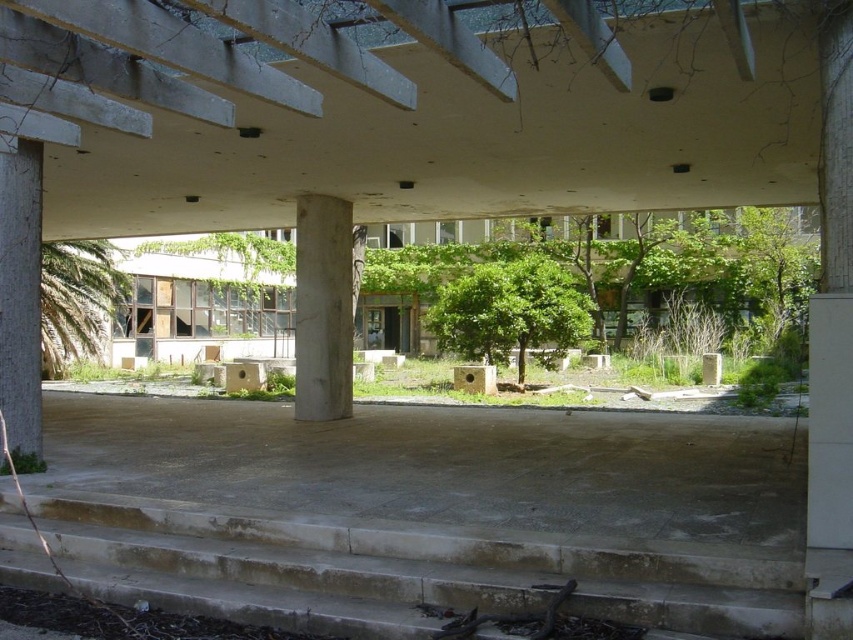
Consider the image. Between concrete stairs at lower left and green leafy tree at left, which one appears on the right side from the viewer's perspective?

concrete stairs at lower left is more to the right.

Is concrete stairs at lower left wider than green leafy tree at left?

In fact, concrete stairs at lower left might be narrower than green leafy tree at left.

Locate an element on the screen. concrete stairs at lower left is located at coordinates (399, 573).

From the picture: Who is taller, green leafy tree at center or green leafy tree at left?

With more height is green leafy tree at center.

Who is higher up, green leafy tree at center or green leafy tree at left?

green leafy tree at center

Which is behind, point (505, 308) or point (73, 358)?

Point (73, 358)

The height and width of the screenshot is (640, 853). What are the coordinates of `green leafy tree at center` in the screenshot? It's located at (509, 310).

Who is shorter, green leafy tree at center or white marble pillar at center?

With less height is white marble pillar at center.

Who is higher up, green leafy tree at center or white marble pillar at center?

green leafy tree at center is higher up.

Who is more forward, (555, 289) or (299, 220)?

Point (299, 220)

Locate an element on the screen. Image resolution: width=853 pixels, height=640 pixels. green leafy tree at center is located at coordinates (509, 310).